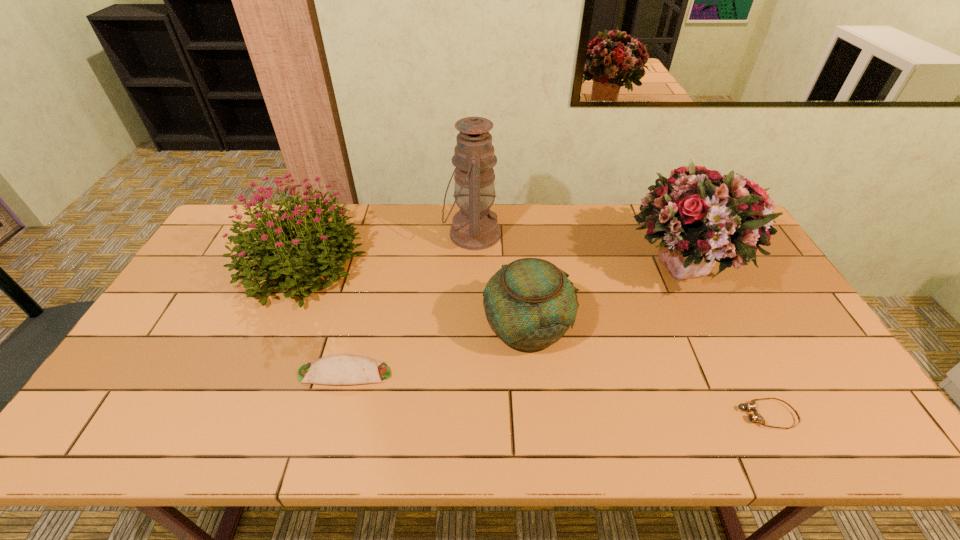
The width and height of the screenshot is (960, 540). What are the coordinates of `object that is the second nearest to the pottery` in the screenshot? It's located at (702, 216).

At what (x,y) coordinates should I click in order to perform the action: click on vacant space that satisfies the following two spatial constraints: 1. on the back side of the oil lamp; 2. on the right side of the left bouquet. Please return your answer as a coordinate pair (x, y). Looking at the image, I should click on (313, 234).

Image resolution: width=960 pixels, height=540 pixels. Find the location of `free spot that satisfies the following two spatial constraints: 1. on the front side of the left bouquet; 2. on the left side of the fourth tallest object`. free spot that satisfies the following two spatial constraints: 1. on the front side of the left bouquet; 2. on the left side of the fourth tallest object is located at coordinates (273, 327).

I want to click on vacant space that satisfies the following two spatial constraints: 1. on the front side of the oil lamp; 2. at the bitten end of the fifth tallest object, so click(469, 373).